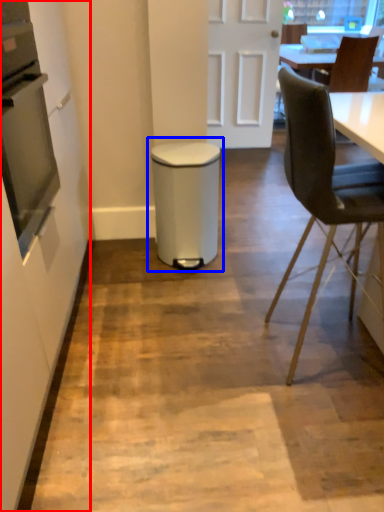
Question: Which object is closer to the camera taking this photo, side (highlighted by a red box) or waste container (highlighted by a blue box)?

Choices:
 (A) side
 (B) waste container

Answer: (A)